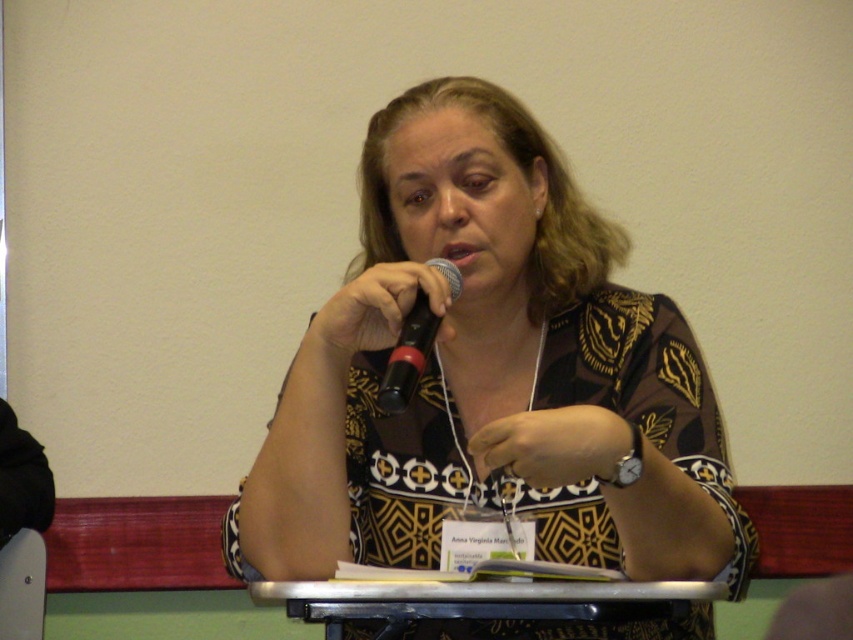
Question: Which object is the closest to the black matte microphone at center?

Choices:
 (A) brown printed blouse at center
 (B) metallic silver table at center

Answer: (A)

Question: Can you confirm if metallic silver table at center is wider than black matte microphone at center?

Choices:
 (A) yes
 (B) no

Answer: (A)

Question: Does metallic silver table at center appear on the left side of black matte microphone at center?

Choices:
 (A) no
 (B) yes

Answer: (A)

Question: Which object is positioned farthest from the metallic silver table at center?

Choices:
 (A) brown printed blouse at center
 (B) black matte microphone at center

Answer: (B)

Question: Which point is closer to the camera?

Choices:
 (A) metallic silver table at center
 (B) black matte microphone at center

Answer: (B)

Question: Is metallic silver table at center to the right of black matte microphone at center from the viewer's perspective?

Choices:
 (A) no
 (B) yes

Answer: (B)